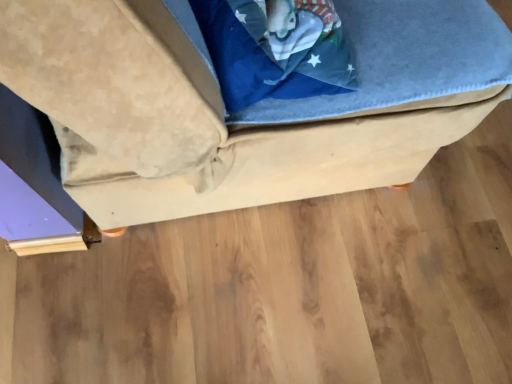
Question: Should I look upward or downward to see suede-like beige ottoman at center?

Choices:
 (A) up
 (B) down

Answer: (A)

Question: Does suede-like beige ottoman at center have a lesser width compared to wooden floor at lower center?

Choices:
 (A) no
 (B) yes

Answer: (B)

Question: From a real-world perspective, does suede-like beige ottoman at center sit lower than wooden floor at lower center?

Choices:
 (A) no
 (B) yes

Answer: (A)

Question: Is suede-like beige ottoman at center positioned with its back to wooden floor at lower center?

Choices:
 (A) yes
 (B) no

Answer: (B)

Question: Does suede-like beige ottoman at center have a lesser height compared to wooden floor at lower center?

Choices:
 (A) yes
 (B) no

Answer: (B)

Question: Does suede-like beige ottoman at center have a larger size compared to wooden floor at lower center?

Choices:
 (A) no
 (B) yes

Answer: (B)

Question: From the image's perspective, is suede-like beige ottoman at center below wooden floor at lower center?

Choices:
 (A) yes
 (B) no

Answer: (B)

Question: Does wooden floor at lower center come in front of suede-like beige ottoman at center?

Choices:
 (A) yes
 (B) no

Answer: (B)

Question: Does wooden floor at lower center have a larger size compared to suede-like beige ottoman at center?

Choices:
 (A) yes
 (B) no

Answer: (B)

Question: Does wooden floor at lower center have a greater height compared to suede-like beige ottoman at center?

Choices:
 (A) yes
 (B) no

Answer: (B)

Question: Is wooden floor at lower center thinner than suede-like beige ottoman at center?

Choices:
 (A) yes
 (B) no

Answer: (B)

Question: Considering the relative positions of wooden floor at lower center and suede-like beige ottoman at center in the image provided, is wooden floor at lower center behind suede-like beige ottoman at center?

Choices:
 (A) no
 (B) yes

Answer: (B)

Question: Can you confirm if wooden floor at lower center is smaller than suede-like beige ottoman at center?

Choices:
 (A) no
 (B) yes

Answer: (B)

Question: From the image's perspective, is suede-like beige ottoman at center positioned above or below wooden floor at lower center?

Choices:
 (A) below
 (B) above

Answer: (B)